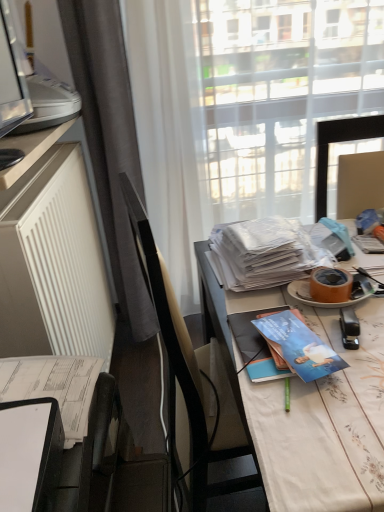
Image resolution: width=384 pixels, height=512 pixels. I want to click on empty space that is ontop of white paper journal at lower left (from a real-world perspective), so click(21, 434).